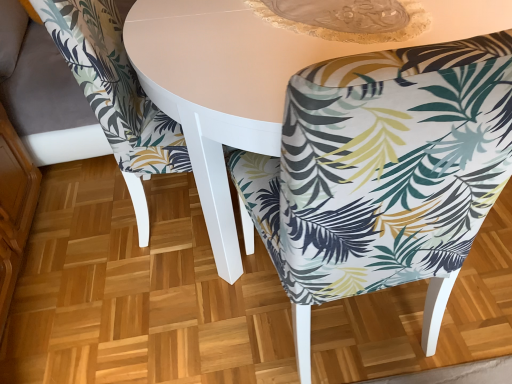
Question: Is white glossy table at center to the right of printed fabric chair at center, arranged as the 1th chair when viewed from the left, from the viewer's perspective?

Choices:
 (A) no
 (B) yes

Answer: (B)

Question: Considering the relative sizes of white glossy table at center and printed fabric chair at center, marked as the second chair in a right-to-left arrangement, in the image provided, is white glossy table at center smaller than printed fabric chair at center, marked as the second chair in a right-to-left arrangement,?

Choices:
 (A) no
 (B) yes

Answer: (A)

Question: Would you consider white glossy table at center to be distant from printed fabric chair at center, marked as the second chair in a right-to-left arrangement?

Choices:
 (A) yes
 (B) no

Answer: (B)

Question: Considering the relative positions of white glossy table at center and printed fabric chair at center, marked as the second chair in a right-to-left arrangement, in the image provided, is white glossy table at center behind printed fabric chair at center, marked as the second chair in a right-to-left arrangement,?

Choices:
 (A) no
 (B) yes

Answer: (A)

Question: Is white glossy table at center located outside printed fabric chair at center, arranged as the 1th chair when viewed from the left?

Choices:
 (A) no
 (B) yes

Answer: (B)

Question: Would you say white glossy table at center is to the left or to the right of printed fabric chair at center, marked as the second chair in a right-to-left arrangement, in the picture?

Choices:
 (A) right
 (B) left

Answer: (A)

Question: From the image's perspective, is white glossy table at center above or below printed fabric chair at center, arranged as the 1th chair when viewed from the left?

Choices:
 (A) below
 (B) above

Answer: (A)

Question: In the image, is white glossy table at center positioned in front of or behind printed fabric chair at center, marked as the second chair in a right-to-left arrangement?

Choices:
 (A) front
 (B) behind

Answer: (A)

Question: Considering the positions of white glossy table at center and printed fabric chair at center, arranged as the 1th chair when viewed from the left, in the image, is white glossy table at center bigger or smaller than printed fabric chair at center, arranged as the 1th chair when viewed from the left,?

Choices:
 (A) big
 (B) small

Answer: (A)

Question: Is point (239, 248) positioned closer to the camera than point (306, 134)?

Choices:
 (A) closer
 (B) farther

Answer: (B)

Question: Visually, is white glossy table at center positioned to the left or to the right of printed fabric chair at center, placed as the first chair when sorted from right to left?

Choices:
 (A) right
 (B) left

Answer: (B)

Question: From a real-world perspective, is white glossy table at center positioned above or below printed fabric chair at center, placed as the first chair when sorted from right to left?

Choices:
 (A) below
 (B) above

Answer: (A)

Question: From the image's perspective, is white glossy table at center above or below printed fabric chair at center, placed as the first chair when sorted from right to left?

Choices:
 (A) above
 (B) below

Answer: (A)

Question: In the image, is printed fabric chair at center, which ranks as the 2th chair in left-to-right order, on the left side or the right side of white glossy table at center?

Choices:
 (A) left
 (B) right

Answer: (B)

Question: Would you say printed fabric chair at center, which ranks as the 2th chair in left-to-right order, is inside or outside white glossy table at center?

Choices:
 (A) outside
 (B) inside

Answer: (B)